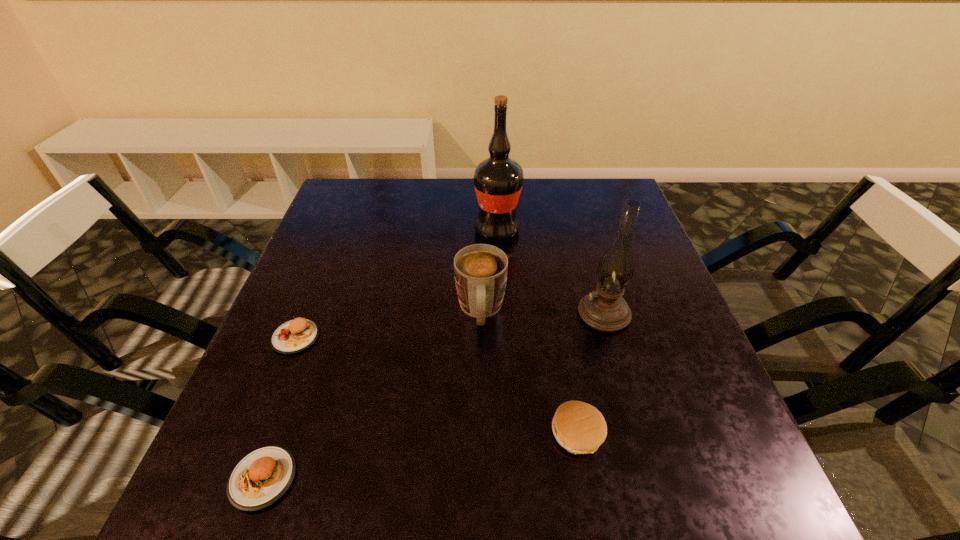
Locate an element on the screen. Image resolution: width=960 pixels, height=540 pixels. vacant space at the right edge of the desktop is located at coordinates (639, 253).

The height and width of the screenshot is (540, 960). Find the location of `blank space at the far left corner of the desktop`. blank space at the far left corner of the desktop is located at coordinates [374, 194].

Locate an element on the screen. vacant region at the far right corner is located at coordinates (601, 198).

Where is `free space at the near right corner`? The image size is (960, 540). free space at the near right corner is located at coordinates [x=761, y=497].

Identify the location of free spot between the farthest food and the fifth shortest object. (449, 325).

Locate an element on the screen. vacant region between the rightmost food and the farthest food is located at coordinates coord(437,385).

Find the location of a particular element. The image size is (960, 540). free space between the farthest object and the fifth shortest object is located at coordinates (550, 272).

The width and height of the screenshot is (960, 540). I want to click on empty space that is in between the farthest food and the tallest object, so click(396, 284).

You are a GUI agent. You are given a task and a screenshot of the screen. Output one action in this format:
    pyautogui.click(x=<x>, y=<y>)
    Task: Click on the empty space between the mug and the second object from right to left
    This screenshot has height=540, width=960.
    Given the screenshot: What is the action you would take?
    pyautogui.click(x=529, y=372)

You are a GUI agent. You are given a task and a screenshot of the screen. Output one action in this format:
    pyautogui.click(x=<x>, y=<y>)
    Task: Click on the blank region between the shortest food and the mug
    The width and height of the screenshot is (960, 540).
    Given the screenshot: What is the action you would take?
    click(372, 395)